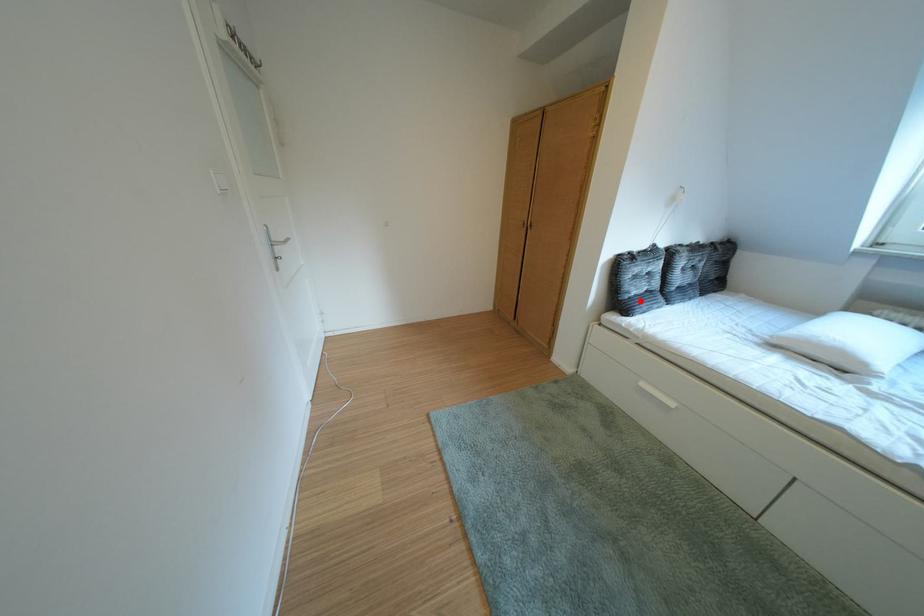
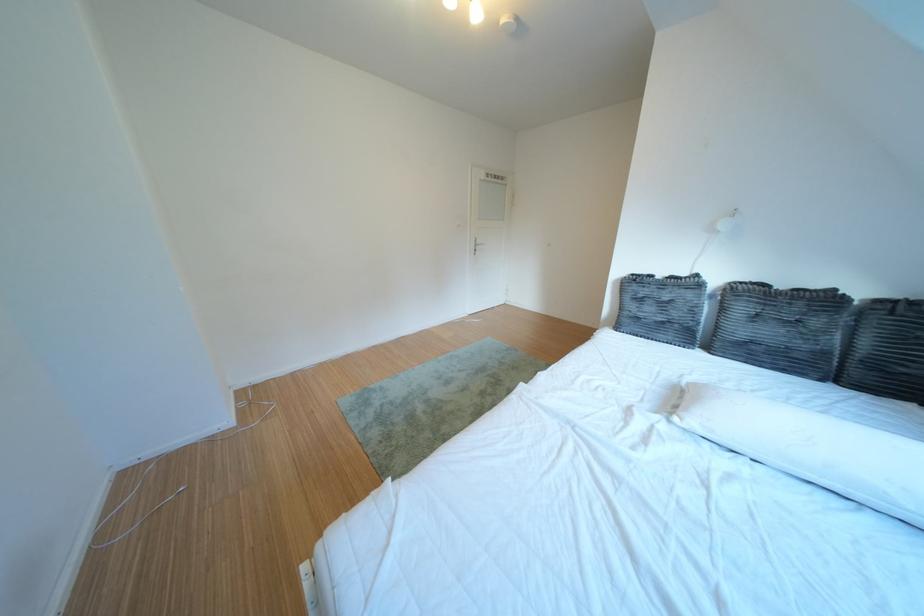
Locate, in the second image, the point that corresponds to the highlighted location in the first image.

(639, 318)